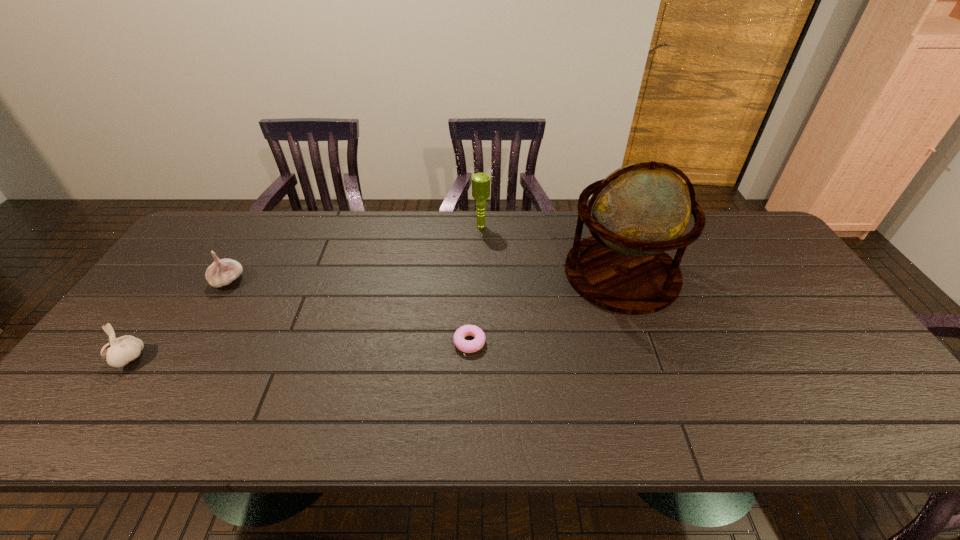
The image size is (960, 540). What are the coordinates of `vacant space that is in between the left garlic and the second object from left to right` in the screenshot? It's located at (178, 320).

At what (x,y) coordinates should I click in order to perform the action: click on vacant area between the leftmost object and the rightmost object. Please return your answer as a coordinate pair (x, y). Looking at the image, I should click on (374, 316).

Where is `unoccupied area between the right garlic and the left garlic`? This screenshot has width=960, height=540. unoccupied area between the right garlic and the left garlic is located at coordinates (178, 320).

The image size is (960, 540). I want to click on object that is the fourth closest one to the left garlic, so click(x=641, y=210).

Choose which object is the second nearest neighbor to the farthest object. Please provide its 2D coordinates. Your answer should be formatted as a tuple, i.e. [(x, y)], where the tuple contains the x and y coordinates of a point satisfying the conditions above.

[(476, 344)]

The image size is (960, 540). Identify the location of vacant space that satisfies the following two spatial constraints: 1. on the back side of the nearer garlic; 2. on the left side of the fourth shortest object. (223, 226).

I want to click on free spot that satisfies the following two spatial constraints: 1. on the front-facing side of the rightmost object; 2. on the front side of the shortest object, so click(x=646, y=343).